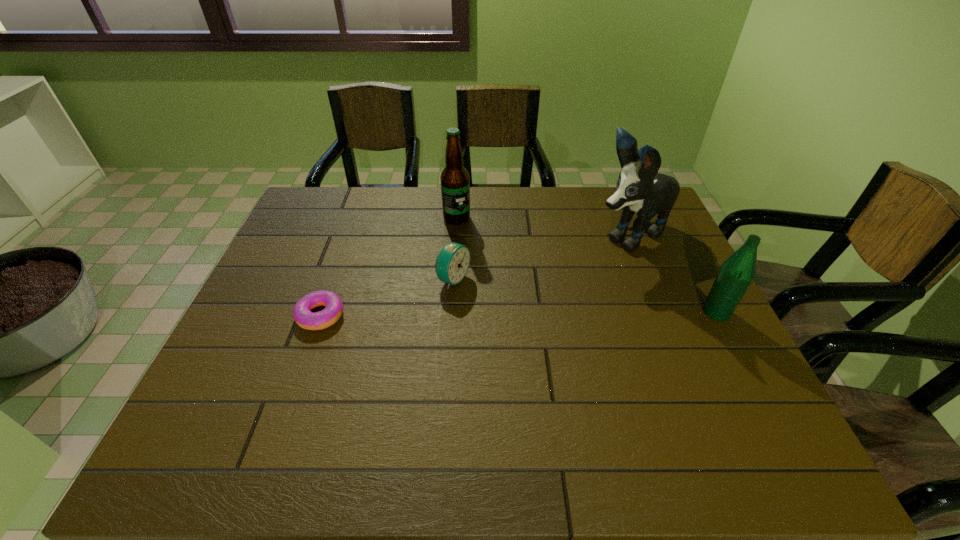
Where is `unoccupied area between the third farthest object and the tallest object`? unoccupied area between the third farthest object and the tallest object is located at coordinates (541, 258).

The image size is (960, 540). I want to click on free space between the tallest object and the shortest object, so click(x=475, y=275).

Identify the location of free space between the tallest object and the third nearest object. (541, 258).

Find the location of a particular element. The image size is (960, 540). free spot between the doughnut and the second shortest object is located at coordinates (387, 298).

Where is `vacant region between the leftmost object and the beer bottle`? vacant region between the leftmost object and the beer bottle is located at coordinates (389, 267).

You are a GUI agent. You are given a task and a screenshot of the screen. Output one action in this format:
    pyautogui.click(x=<x>, y=<y>)
    Task: Click on the free area in between the puppy and the alarm clock
    
    Given the screenshot: What is the action you would take?
    pyautogui.click(x=541, y=258)

Image resolution: width=960 pixels, height=540 pixels. In order to click on free space between the third tallest object and the second tallest object in this screenshot , I will do `click(587, 265)`.

You are a GUI agent. You are given a task and a screenshot of the screen. Output one action in this format:
    pyautogui.click(x=<x>, y=<y>)
    Task: Click on the vacant area that lies between the fourth shortest object and the bottle
    Image resolution: width=960 pixels, height=540 pixels.
    Given the screenshot: What is the action you would take?
    pyautogui.click(x=587, y=265)

The width and height of the screenshot is (960, 540). Identify the location of free spot between the leftmost object and the beer bottle. (389, 267).

The image size is (960, 540). Find the location of `object that is the nearest to the tallest object`. object that is the nearest to the tallest object is located at coordinates (735, 275).